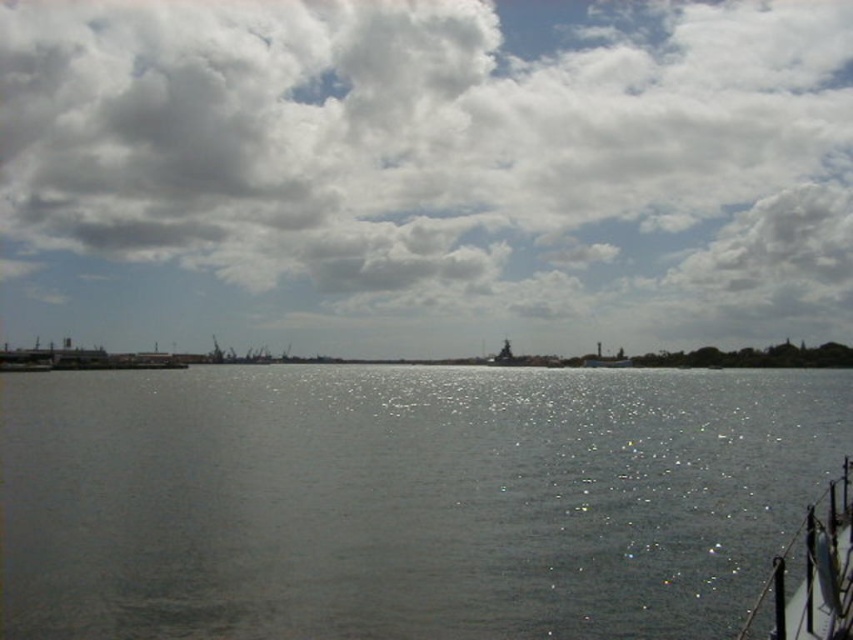
You are standing at the edge of the waterfront scene and want to locate the gray water at center. What are the coordinates where you should look to find it?

The gray water at center is located at coordinates point (404, 499).